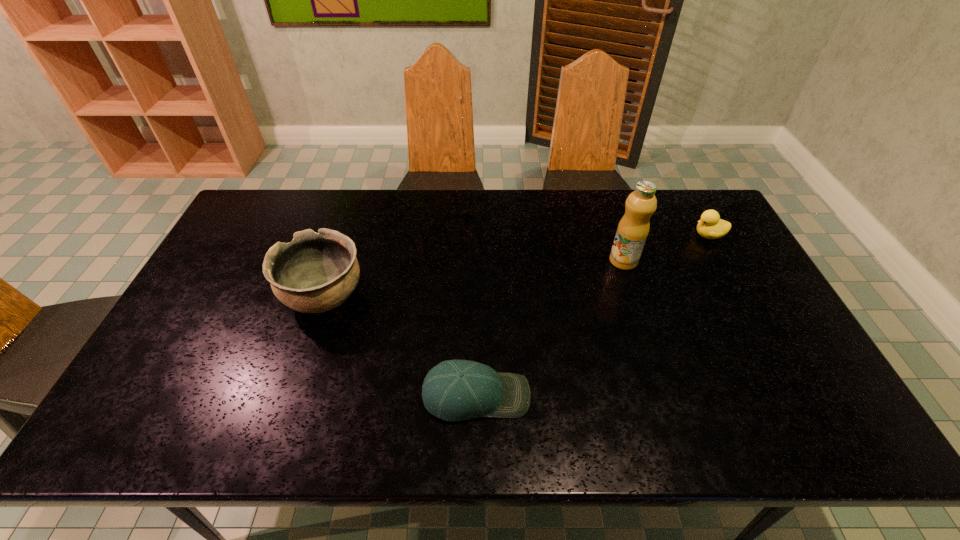
Find the location of a particular element. blank space located on the front-facing side of the farthest object is located at coordinates (585, 235).

What are the coordinates of `free spot located on the front-facing side of the farthest object` in the screenshot? It's located at (590, 235).

Locate an element on the screen. This screenshot has height=540, width=960. vacant region located 0.390m on the front-facing side of the farthest object is located at coordinates (575, 235).

Identify the location of vacant space located 0.290m on the back of the nearest object. (477, 285).

In order to click on object located at the far edge in this screenshot , I will do `click(710, 226)`.

Where is `object that is at the near edge`? The image size is (960, 540). object that is at the near edge is located at coordinates (454, 390).

The height and width of the screenshot is (540, 960). What are the coordinates of `object that is at the right edge` in the screenshot? It's located at (710, 226).

Find the location of `object located in the far right corner section of the desktop`. object located in the far right corner section of the desktop is located at coordinates (710, 226).

Image resolution: width=960 pixels, height=540 pixels. Identify the location of free space at the far edge of the desktop. (479, 215).

This screenshot has width=960, height=540. I want to click on free space at the near edge of the desktop, so click(x=520, y=418).